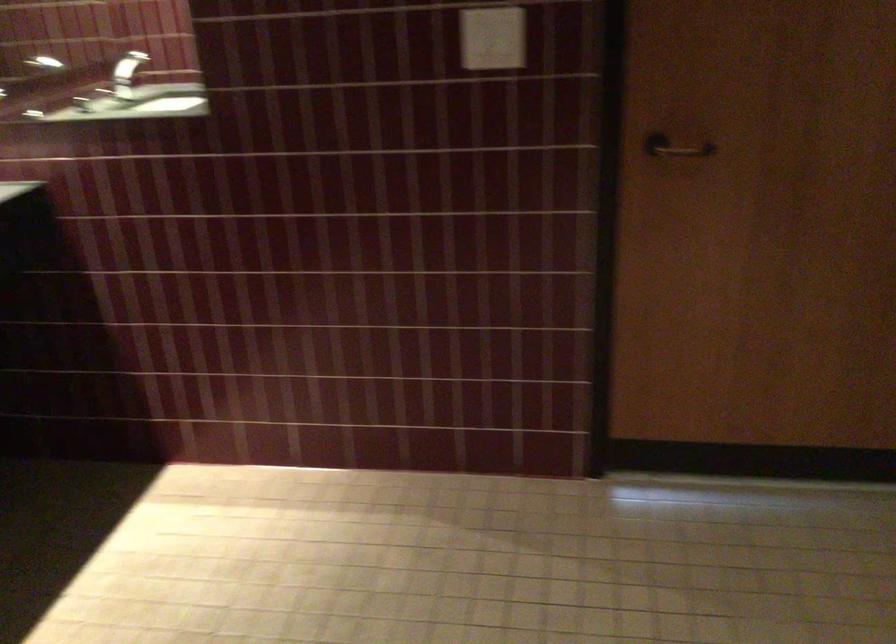
At what (x,y) coordinates should I click in order to perform the action: click on chrome faucet handle. Please return your answer as a coordinate pair (x, y). Image resolution: width=896 pixels, height=644 pixels. Looking at the image, I should click on (126, 73).